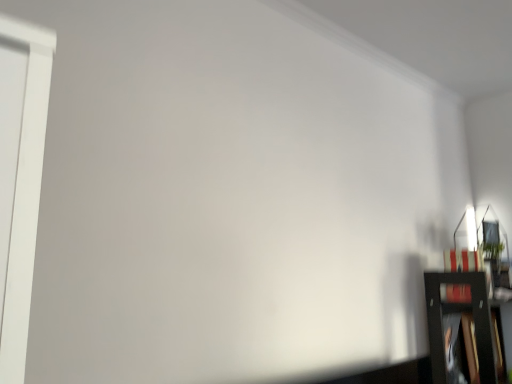
What do you see at coordinates (458, 322) in the screenshot?
I see `black glossy bookshelf at lower right` at bounding box center [458, 322].

This screenshot has height=384, width=512. Identify the location of black glossy bookshelf at lower right. (458, 322).

Where is `black glossy bookshelf at lower right`? black glossy bookshelf at lower right is located at coordinates (458, 322).